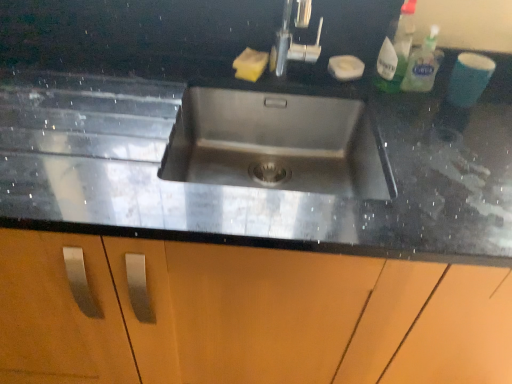
Question: Can white matte soap at upper right, which is the 2th soap from left to right, be found inside black granite sink at center?

Choices:
 (A) yes
 (B) no

Answer: (B)

Question: Is black granite sink at center wider than white matte soap at upper right, which is the 2th soap from left to right?

Choices:
 (A) no
 (B) yes

Answer: (B)

Question: Is black granite sink at center at the left side of white matte soap at upper right, which is the first soap in right-to-left order?

Choices:
 (A) no
 (B) yes

Answer: (B)

Question: Can you see black granite sink at center touching white matte soap at upper right, which is the 2th soap from left to right?

Choices:
 (A) yes
 (B) no

Answer: (B)

Question: Does black granite sink at center have a larger size compared to white matte soap at upper right, which is the 2th soap from left to right?

Choices:
 (A) no
 (B) yes

Answer: (B)

Question: Is yellow sponge at upper center, acting as the second soap starting from the right, taller or shorter than black granite sink at center?

Choices:
 (A) short
 (B) tall

Answer: (A)

Question: In the image, is yellow sponge at upper center, acting as the second soap starting from the right, positioned in front of or behind black granite sink at center?

Choices:
 (A) front
 (B) behind

Answer: (B)

Question: From the image's perspective, is yellow sponge at upper center, which ranks as the first soap in left-to-right order, above or below black granite sink at center?

Choices:
 (A) below
 (B) above

Answer: (B)

Question: Choose the correct answer: Is yellow sponge at upper center, which ranks as the first soap in left-to-right order, inside black granite sink at center or outside it?

Choices:
 (A) outside
 (B) inside

Answer: (A)

Question: Is translucent plastic spray bottle at upper right, which appears as the 1th cleaning product when viewed from the left, in front of or behind black granite sink at center in the image?

Choices:
 (A) front
 (B) behind

Answer: (B)

Question: Based on their sizes in the image, would you say translucent plastic spray bottle at upper right, which appears as the 1th cleaning product when viewed from the left, is bigger or smaller than black granite sink at center?

Choices:
 (A) small
 (B) big

Answer: (A)

Question: Which is correct: translucent plastic spray bottle at upper right, which appears as the 1th cleaning product when viewed from the left, is inside black granite sink at center, or outside of it?

Choices:
 (A) inside
 (B) outside

Answer: (B)

Question: Is translucent plastic spray bottle at upper right, which appears as the 1th cleaning product when viewed from the left, to the left or to the right of black granite sink at center in the image?

Choices:
 (A) right
 (B) left

Answer: (A)

Question: Is yellow sponge at upper center, which ranks as the first soap in left-to-right order, bigger or smaller than white matte soap at upper right, which is the 2th soap from left to right?

Choices:
 (A) small
 (B) big

Answer: (A)

Question: From the image's perspective, is yellow sponge at upper center, which ranks as the first soap in left-to-right order, above or below white matte soap at upper right, which is the 2th soap from left to right?

Choices:
 (A) below
 (B) above

Answer: (B)